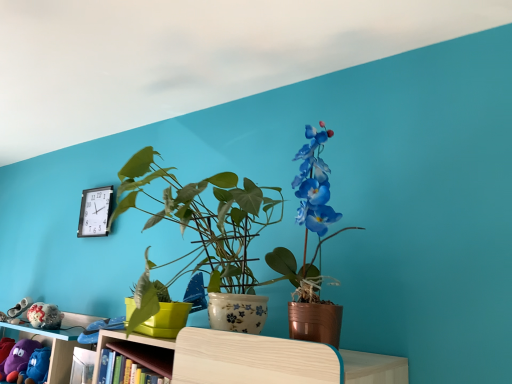
Question: Is purple fabric plush at lower left to the left or to the right of black plastic clock at upper left in the image?

Choices:
 (A) left
 (B) right

Answer: (A)

Question: From the image's perspective, is purple fabric plush at lower left above or below black plastic clock at upper left?

Choices:
 (A) above
 (B) below

Answer: (B)

Question: Estimate the real-world distances between objects in this image. Which object is closer to the purple fabric plush at lower left?

Choices:
 (A) black plastic clock at upper left
 (B) metallic copper pot at center

Answer: (A)

Question: Which object is the closest to the purple fabric plush at lower left?

Choices:
 (A) metallic copper pot at center
 (B) black plastic clock at upper left

Answer: (B)